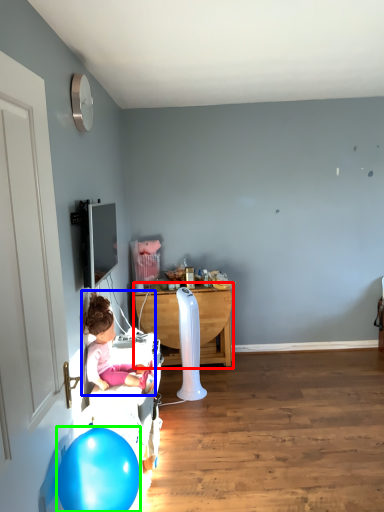
Question: Estimate the real-world distances between objects in this image. Which object is farther from table (highlighted by a red box), person (highlighted by a blue box) or balloon (highlighted by a green box)?

Choices:
 (A) person
 (B) balloon

Answer: (B)